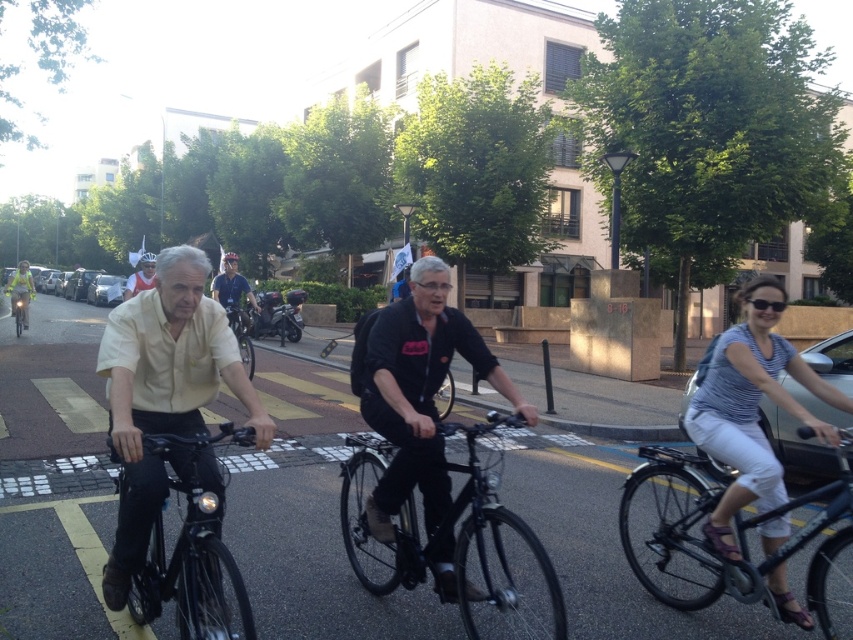
You are a delivery person who needs to choose between the shiny metallic bicycle at center and the shiny blue helmet at upper left. Which item is narrower?

The shiny metallic bicycle at center is narrower than the shiny blue helmet at upper left.

You are a delivery person standing 50 feet away from the shiny black helmet at center. You need to deliver a package to the helmet. Can you reach it without moving closer than 30 feet?

The shiny black helmet at center is 36.33 feet away from the camera. Since you are standing 50 feet away, you are already beyond the 30 feet minimum distance required. Therefore, you can reach the helmet without moving closer than 30 feet.